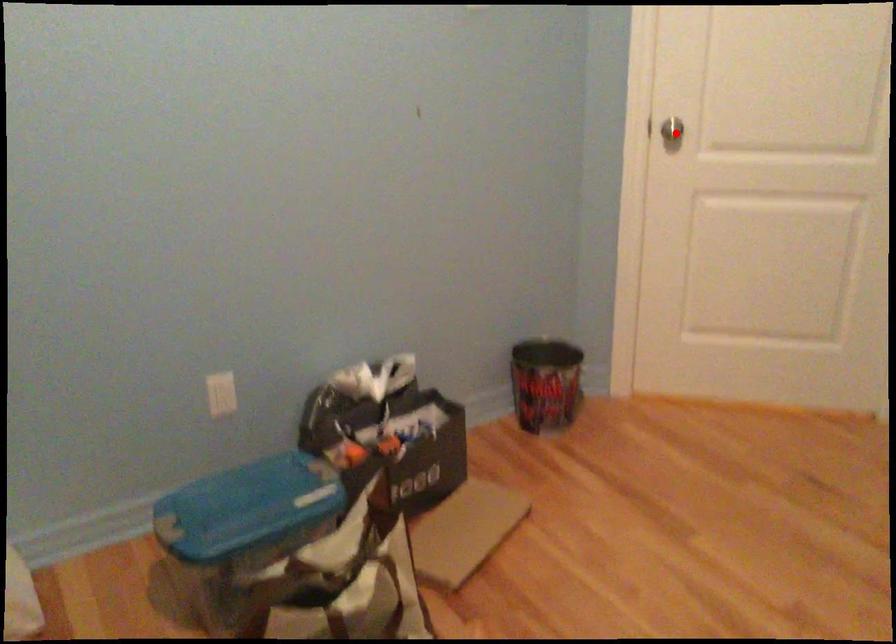
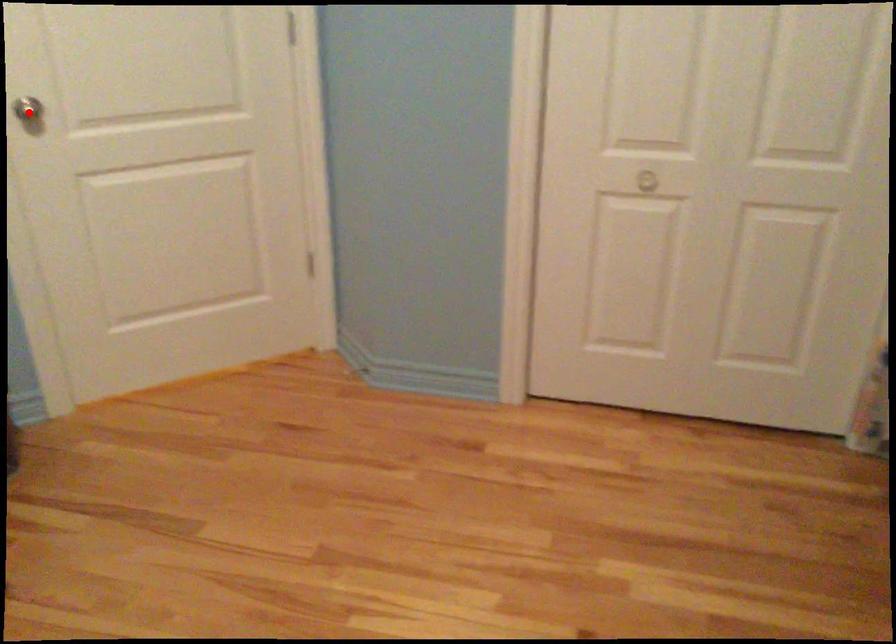
I am providing you with two images of the same scene from different viewpoints. A red point is marked on the first image and another point is marked on the second image. Is the marked point in image1 the same physical position as the marked point in image2?

Yes